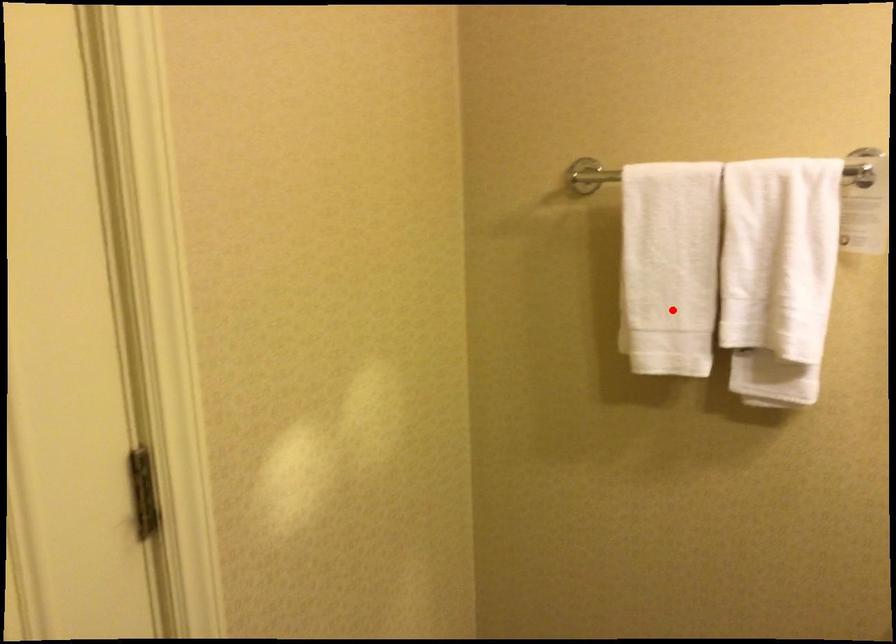
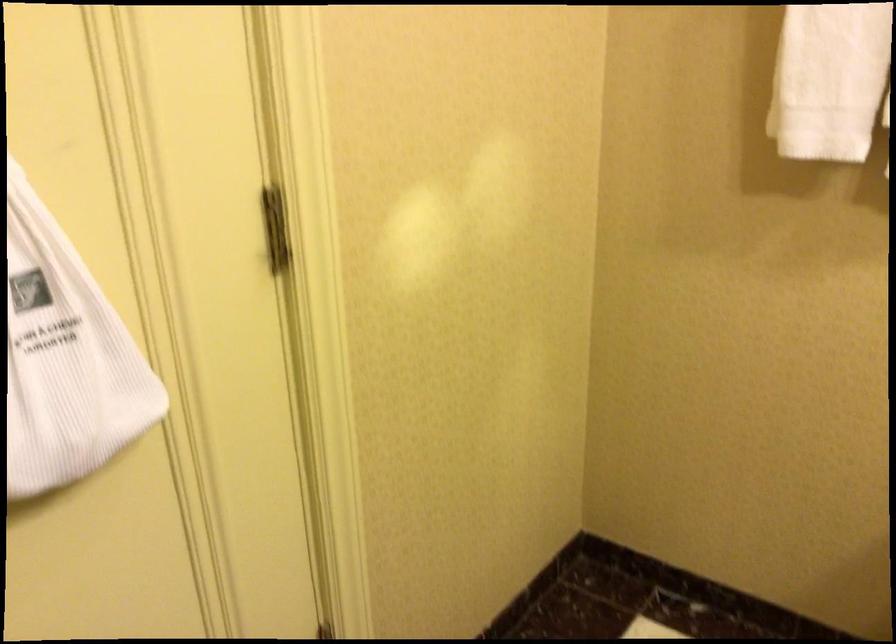
Question: I am providing you with two images of the same scene from different viewpoints. A red point is marked on the first image. Is the red point's position out of view in image 2?

Choices:
 (A) Yes
 (B) No

Answer: (B)